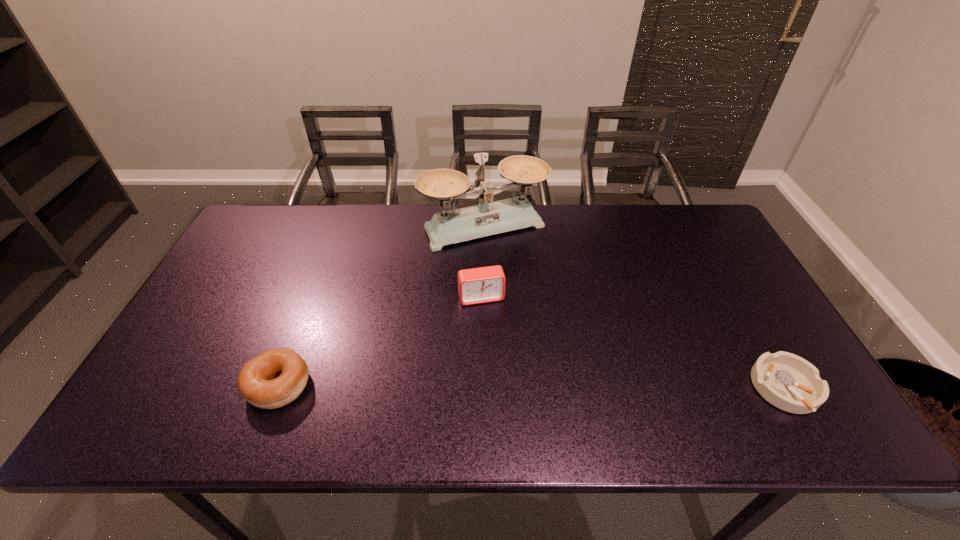
You are a GUI agent. You are given a task and a screenshot of the screen. Output one action in this format:
    pyautogui.click(x=<x>, y=<y>)
    Task: Click on the object present at the near right corner
    
    Given the screenshot: What is the action you would take?
    pyautogui.click(x=787, y=381)

Locate an element on the screen. The image size is (960, 540). free spot at the far edge of the desktop is located at coordinates (655, 209).

The width and height of the screenshot is (960, 540). I want to click on vacant position at the near edge of the desktop, so click(x=730, y=390).

At what (x,y) coordinates should I click in order to perform the action: click on blank space at the left edge of the desktop. Please return your answer as a coordinate pair (x, y). Looking at the image, I should click on (207, 301).

Locate an element on the screen. The width and height of the screenshot is (960, 540). blank space at the right edge of the desktop is located at coordinates (730, 255).

Locate an element on the screen. The width and height of the screenshot is (960, 540). vacant space at the far left corner is located at coordinates (258, 213).

Locate an element on the screen. Image resolution: width=960 pixels, height=540 pixels. vacant space at the near left corner of the desktop is located at coordinates (182, 368).

In the image, there is a desktop. Where is `vacant space at the far right corner`? The height and width of the screenshot is (540, 960). vacant space at the far right corner is located at coordinates (680, 210).

Find the location of a particular element. The height and width of the screenshot is (540, 960). vacant point located between the third shortest object and the ashtray is located at coordinates (634, 343).

Where is `vacant point located between the farthest object and the shortest object`? Image resolution: width=960 pixels, height=540 pixels. vacant point located between the farthest object and the shortest object is located at coordinates (635, 308).